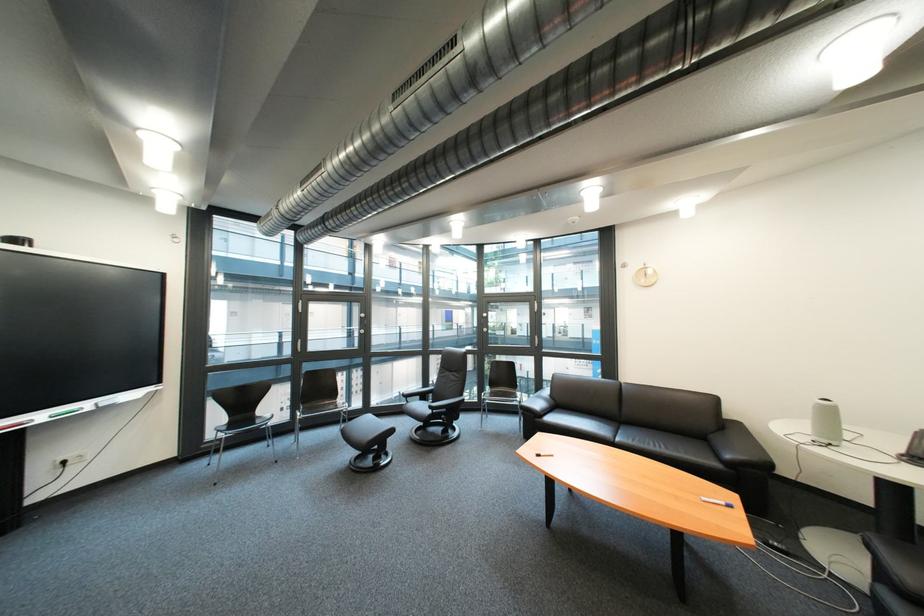
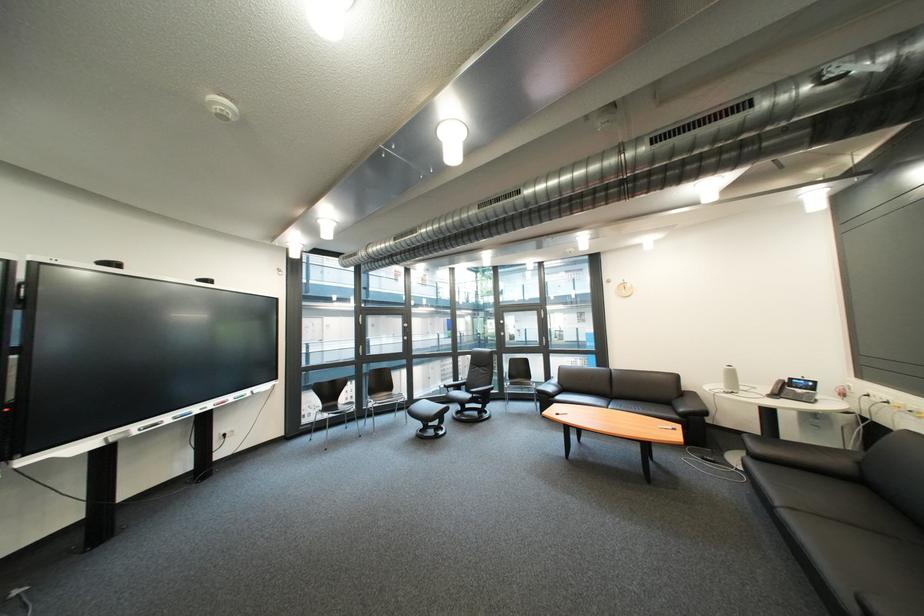
The images are taken continuously from a first-person perspective. In which direction are you moving?

The cameraman walked toward left, backward.